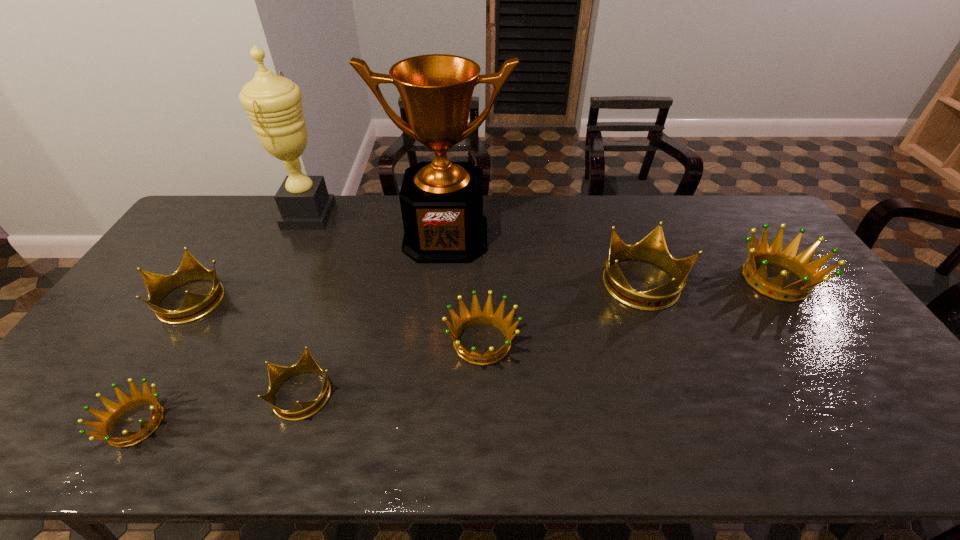
Image resolution: width=960 pixels, height=540 pixels. Find the location of `the left trophy cup`. the left trophy cup is located at coordinates (273, 103).

Identify the location of yellow trophy cup. (273, 103).

You are a GUI agent. You are given a task and a screenshot of the screen. Output one action in this format:
    pyautogui.click(x=<x>, y=<y>)
    Task: Click on the right trophy cup
    
    Given the screenshot: What is the action you would take?
    pyautogui.click(x=441, y=201)

The image size is (960, 540). Identify the location of the rightmost gold crown. (653, 249).

You are a GUI agent. You are given a task and a screenshot of the screen. Output one action in this format:
    pyautogui.click(x=<x>, y=<y>)
    Task: Click on the seventh object from left to right
    The height and width of the screenshot is (540, 960).
    Given the screenshot: What is the action you would take?
    pyautogui.click(x=653, y=249)

What are the coordinates of `the rightmost golden crown` in the screenshot? It's located at (809, 273).

I want to click on the rightmost crown, so click(x=809, y=273).

This screenshot has height=540, width=960. Find the location of `the second smallest gold crown`. the second smallest gold crown is located at coordinates (195, 306).

Image resolution: width=960 pixels, height=540 pixels. What are the coordinates of `the second golden crown from right to left` in the screenshot? It's located at (477, 316).

I want to click on the second smallest golden crown, so (477, 316).